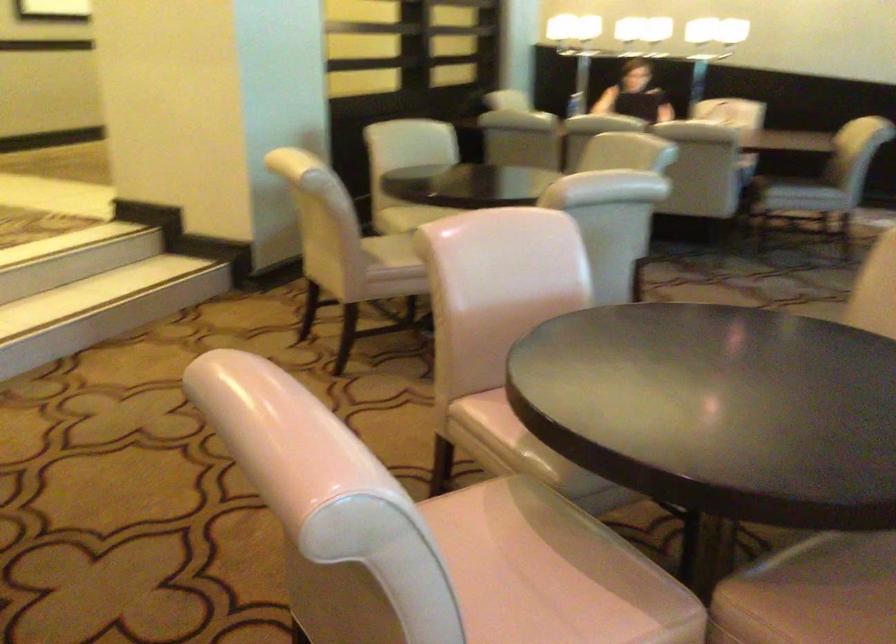
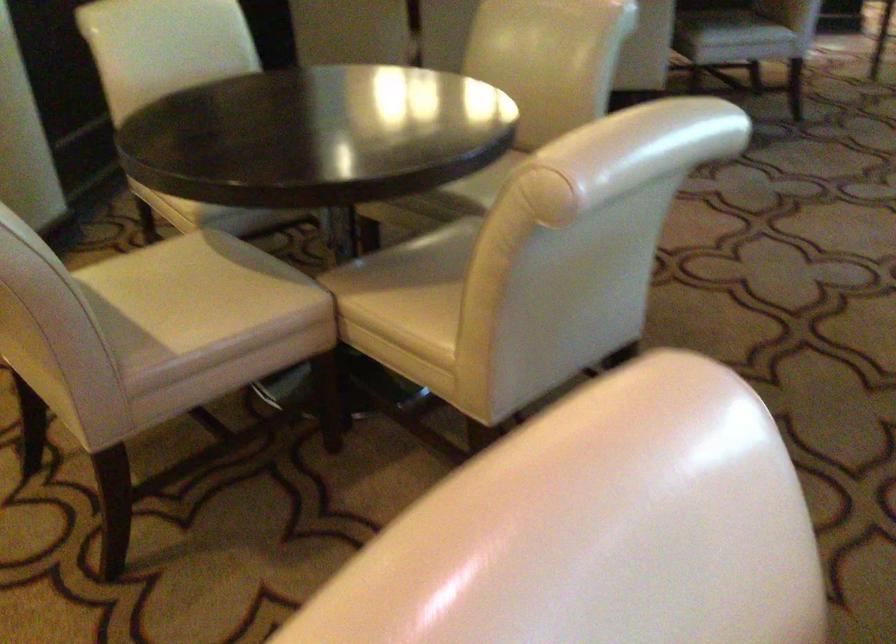
Question: Which direction would the cameraman need to move to produce the second image? Reply with the corresponding letter.

Choices:
 (A) Left
 (B) Right
 (C) Forward
 (D) Backward

Answer: (C)